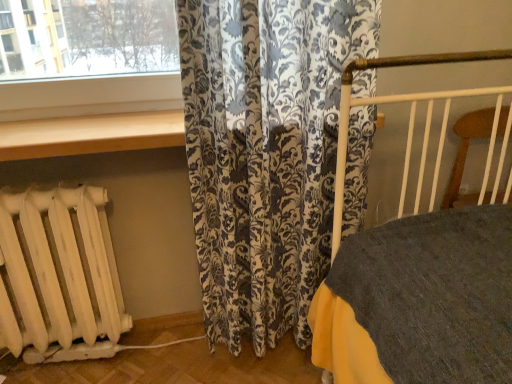
Question: From a real-world perspective, is floral-patterned fabric at center physically located above or below wooden at upper center?

Choices:
 (A) below
 (B) above

Answer: (A)

Question: Looking at the image, does floral-patterned fabric at center seem bigger or smaller compared to wooden at upper center?

Choices:
 (A) small
 (B) big

Answer: (B)

Question: Which object is the closest to the floral-patterned fabric at center?

Choices:
 (A) white matte radiator at lower left
 (B) wooden at upper center

Answer: (B)

Question: Based on their relative distances, which object is nearer to the floral-patterned fabric at center?

Choices:
 (A) wooden at upper center
 (B) white matte radiator at lower left

Answer: (A)